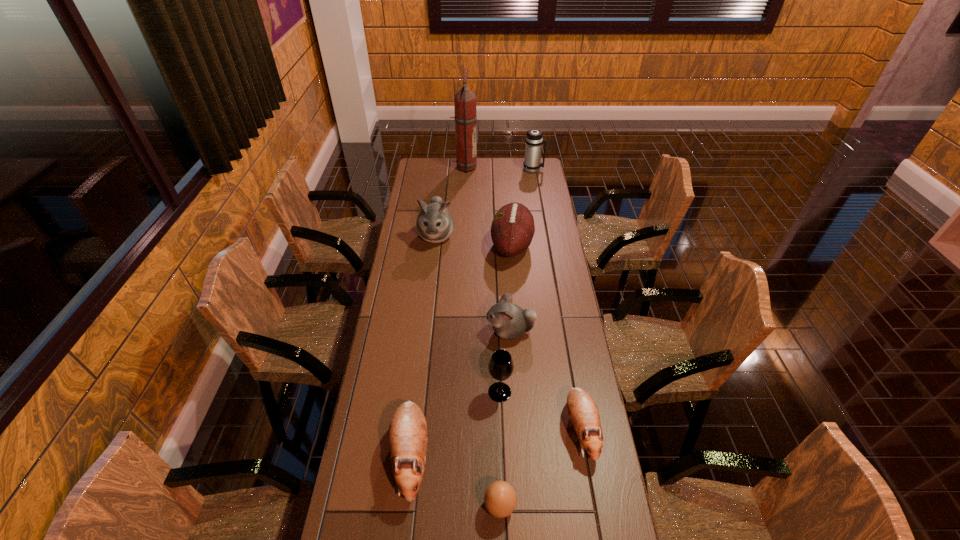
You are a GUI agent. You are given a task and a screenshot of the screen. Output one action in this format:
    pyautogui.click(x=<x>, y=<y>)
    Task: Click on the free spot located at the face of the bigger brown hamster
    
    Given the screenshot: What is the action you would take?
    pyautogui.click(x=402, y=530)

Locate an element on the screen. The image size is (960, 540). free region located at the face of the shortest hamster is located at coordinates (599, 537).

Locate an element on the screen. The height and width of the screenshot is (540, 960). vacant region located on the back of the brown boiled egg is located at coordinates (496, 384).

Image resolution: width=960 pixels, height=540 pixels. What are the coordinates of `fire extinguisher situated at the far edge` in the screenshot? It's located at (465, 117).

Image resolution: width=960 pixels, height=540 pixels. Find the location of `thermos bottle that is positioned at the far edge`. thermos bottle that is positioned at the far edge is located at coordinates (534, 139).

Where is `thermos bottle that is positioned at the right edge`? Image resolution: width=960 pixels, height=540 pixels. thermos bottle that is positioned at the right edge is located at coordinates (534, 139).

You are a GUI agent. You are given a task and a screenshot of the screen. Output one action in this format:
    pyautogui.click(x=<x>, y=<y>)
    Task: Click on the football (American) that is positioned at the right edge
    Image resolution: width=960 pixels, height=540 pixels.
    Given the screenshot: What is the action you would take?
    512,230

I want to click on hamster present at the right edge, so click(x=583, y=412).

You are a GUI agent. You are given a task and a screenshot of the screen. Output one action in this format:
    pyautogui.click(x=<x>, y=<y>)
    Task: Click on the object that is at the far right corner
    This screenshot has height=540, width=960.
    Given the screenshot: What is the action you would take?
    pyautogui.click(x=534, y=139)

You are a GUI agent. You are given a task and a screenshot of the screen. Output one action in this format:
    pyautogui.click(x=<x>, y=<y>)
    Task: Click on the vacant space at the far edge
    Image resolution: width=960 pixels, height=540 pixels.
    Given the screenshot: What is the action you would take?
    pyautogui.click(x=473, y=178)